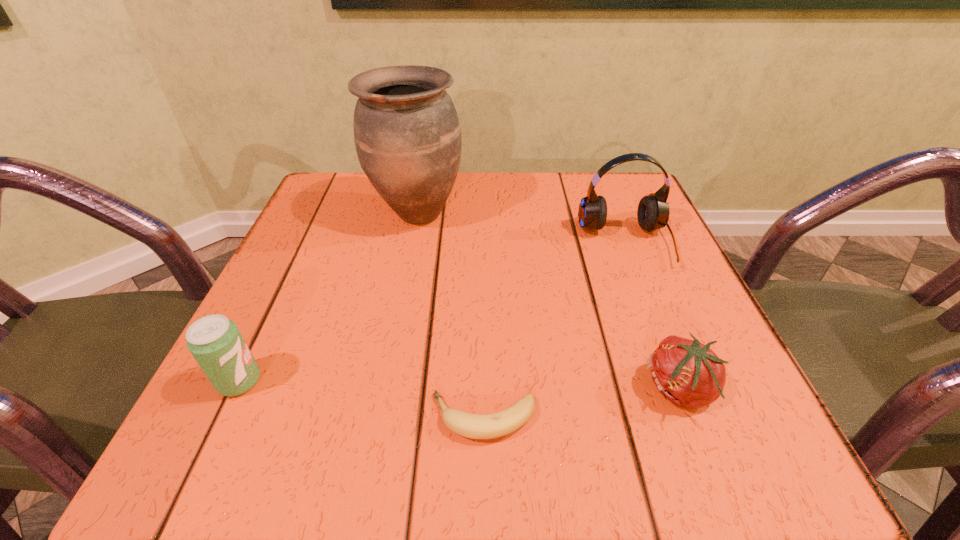
This screenshot has width=960, height=540. What are the coordinates of `urn` in the screenshot? It's located at (407, 135).

This screenshot has height=540, width=960. Identify the location of the second tallest object. (653, 211).

Locate an element on the screen. soda is located at coordinates (215, 342).

You are a GUI agent. You are given a task and a screenshot of the screen. Output one action in this format:
    pyautogui.click(x=<x>, y=<y>)
    Task: Click on the leftmost object
    This screenshot has width=960, height=540.
    Given the screenshot: What is the action you would take?
    pyautogui.click(x=215, y=342)

Where is `the fourth tallest object`? the fourth tallest object is located at coordinates (688, 373).

Locate an element on the screen. This screenshot has width=960, height=540. banana is located at coordinates (474, 426).

I want to click on free space located 0.270m on the right of the tallest object, so click(590, 213).

The height and width of the screenshot is (540, 960). Find the location of `vacant space situated 0.340m on the ear cushions of the second tallest object`. vacant space situated 0.340m on the ear cushions of the second tallest object is located at coordinates (708, 450).

The width and height of the screenshot is (960, 540). Identify the location of free region located 0.270m on the back of the leftmost object. (302, 249).

You are a GUI agent. You are given a task and a screenshot of the screen. Output one action in this format:
    pyautogui.click(x=<x>, y=<y>)
    Task: Click on the blank space located 0.300m on the back of the tomato
    The image size is (960, 540).
    Given the screenshot: What is the action you would take?
    pyautogui.click(x=621, y=237)